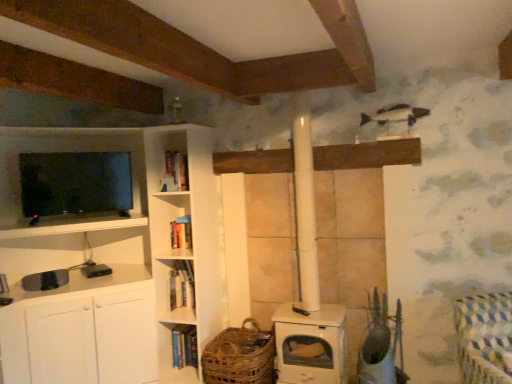
The height and width of the screenshot is (384, 512). What do you see at coordinates (240, 356) in the screenshot?
I see `woven brown basket at lower center` at bounding box center [240, 356].

Image resolution: width=512 pixels, height=384 pixels. What are the coordinates of `woven brown basket at lower center` in the screenshot? It's located at (240, 356).

Find the location of a particular element. The width and height of the screenshot is (512, 384). woven brown basket at lower center is located at coordinates (240, 356).